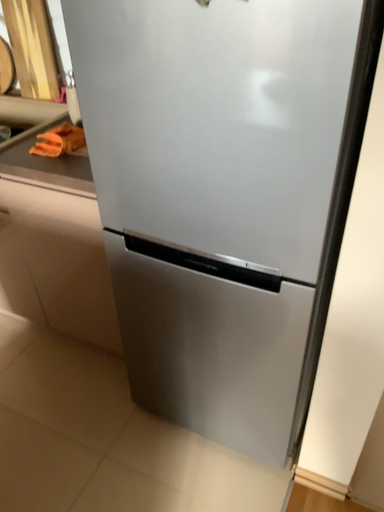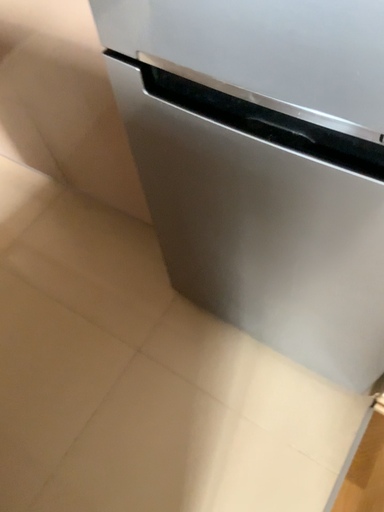
Question: Which way did the camera rotate in the video?

Choices:
 (A) rotated upward
 (B) rotated downward

Answer: (B)